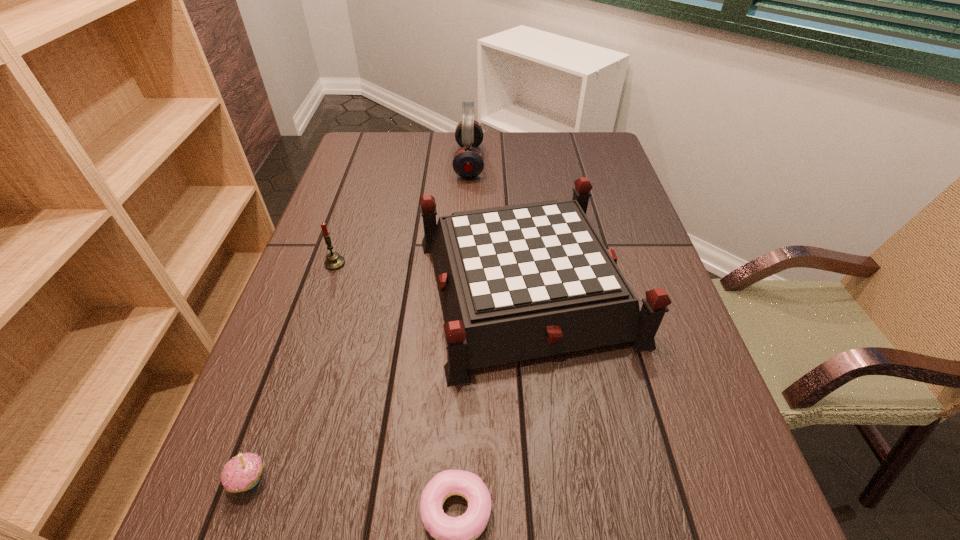
Image resolution: width=960 pixels, height=540 pixels. What are the coordinates of `empty space between the earphone and the second shortest object` in the screenshot? It's located at (359, 321).

What are the coordinates of `vacant space that's between the tallest object and the second shortest object` in the screenshot? It's located at tap(359, 321).

Point out which object is positioned as the fourth nearest to the fourth tallest object. Please provide its 2D coordinates. Your answer should be formatted as a tuple, i.e. [(x, y)], where the tuple contains the x and y coordinates of a point satisfying the conditions above.

[(468, 162)]

Where is `object that stands as the second closest to the tallest object`? This screenshot has width=960, height=540. object that stands as the second closest to the tallest object is located at coordinates (334, 261).

At what (x,y) coordinates should I click in order to perform the action: click on vacant space that satisfies the following two spatial constraints: 1. on the ear cups of the farthest object; 2. on the left side of the fourth shortest object. Please return your answer as a coordinate pair (x, y). Image resolution: width=960 pixels, height=540 pixels. Looking at the image, I should click on (465, 289).

You are a GUI agent. You are given a task and a screenshot of the screen. Output one action in this format:
    pyautogui.click(x=<x>, y=<y>)
    Task: Click on the free space that satisfies the following two spatial constraints: 1. on the ear cups of the farthest object; 2. on the back side of the second tallest object
    The height and width of the screenshot is (540, 960).
    Given the screenshot: What is the action you would take?
    (x=465, y=289)

Identify the location of free space that satisfies the following two spatial constraints: 1. on the back side of the third shortest object; 2. on the left side of the cupcake. (326, 264).

At what (x,y) coordinates should I click in order to perform the action: click on vacant region that satisfies the following two spatial constraints: 1. on the back side of the checkerboard; 2. on the right side of the second shortest object. Please return your answer as a coordinate pair (x, y). Looking at the image, I should click on (317, 289).

Identify the location of free region that satisfies the following two spatial constraints: 1. on the back side of the second tallest object; 2. on the ear cups of the tallest object. The width and height of the screenshot is (960, 540). (513, 162).